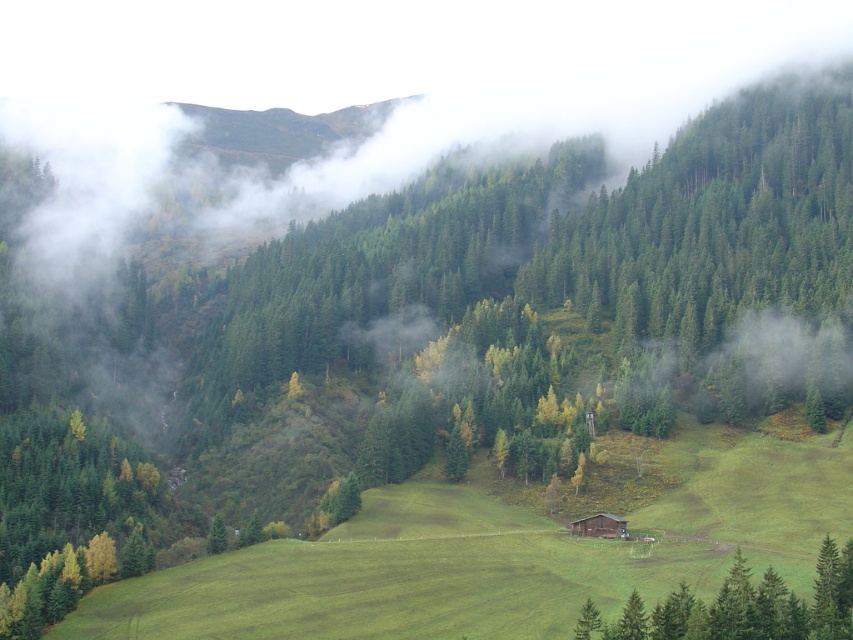
Is green matte tree at lower right wider than brown wooden cabin at center?

Yes.

Can you confirm if green matte tree at lower right is thinner than brown wooden cabin at center?

Incorrect, green matte tree at lower right's width is not less than brown wooden cabin at center's.

Where is `green matte tree at lower right`? green matte tree at lower right is located at coordinates (741, 608).

Locate an element on the screen. Image resolution: width=853 pixels, height=640 pixels. green matte tree at lower right is located at coordinates (741, 608).